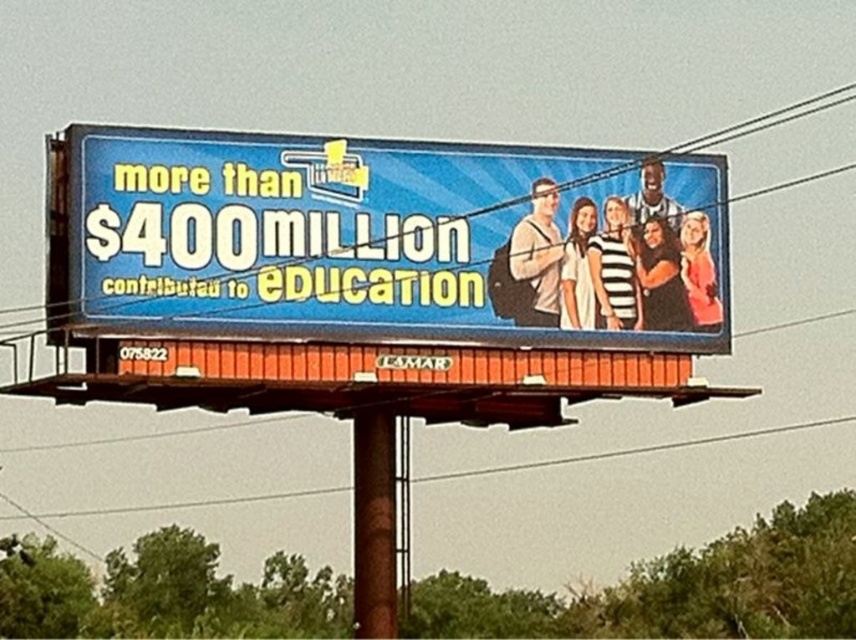
You are a painter standing on a ladder trying to paint the blue plastic billboard at upper center and the brown wood pole at center. Which object will require you to climb higher on the ladder?

The brown wood pole at center requires climbing higher because the blue plastic billboard at upper center is not as tall as the brown wood pole at center.

You are a pedestrian walking along the roadside and notice the blue plastic billboard at upper center and the brown wood pole at center. Which object is located higher up in the image?

The blue plastic billboard at upper center is positioned over the brown wood pole at center, meaning it is higher up in the image.